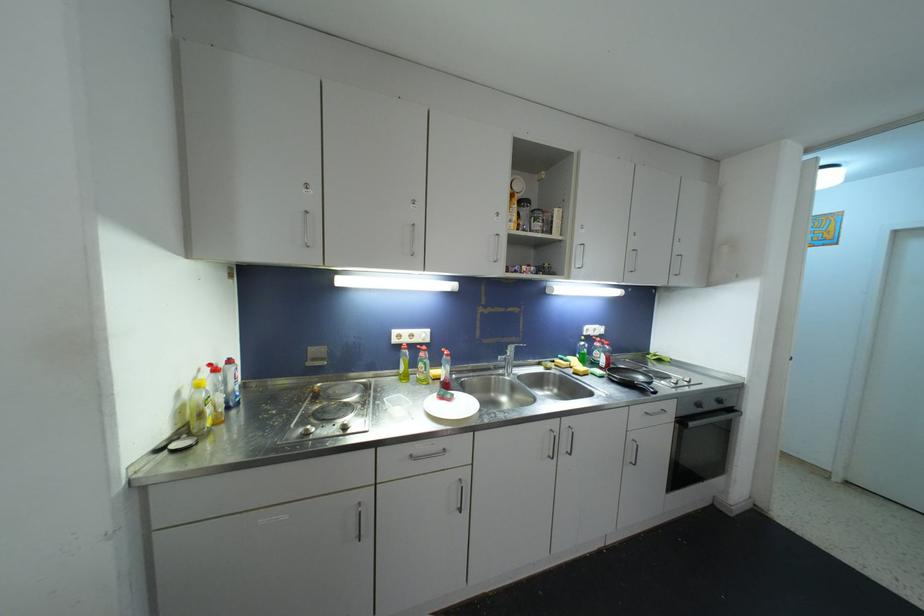
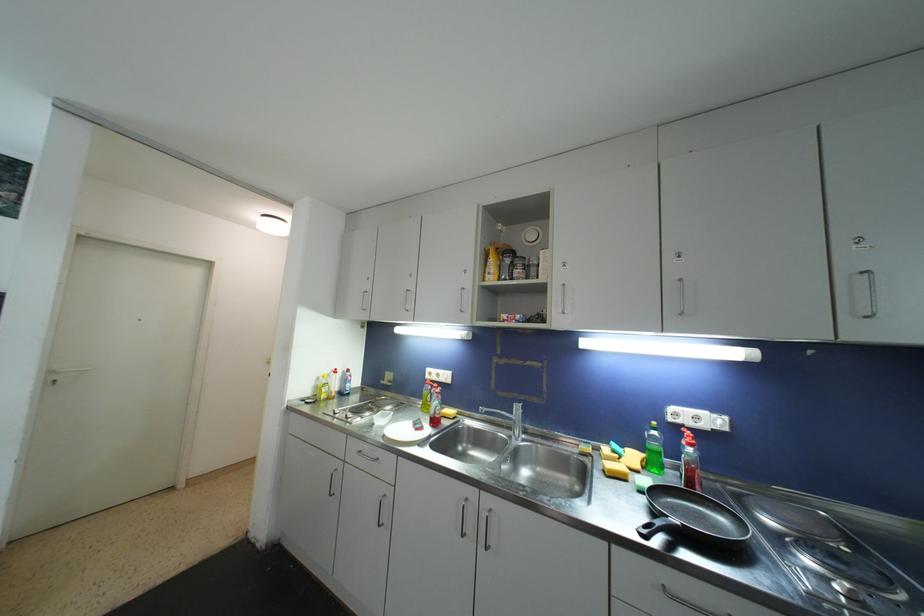
Locate, in the second image, the point that corresponds to point 514,224 in the first image.

(492, 276)